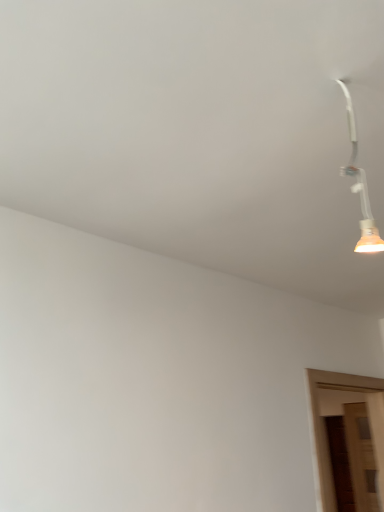
Question: Is wooden door at lower right taller or shorter than white plastic lamp at upper right?

Choices:
 (A) tall
 (B) short

Answer: (A)

Question: From the image's perspective, relative to white plastic lamp at upper right, is wooden door at lower right above or below?

Choices:
 (A) below
 (B) above

Answer: (A)

Question: Considering the positions of point (316, 385) and point (367, 233), is point (316, 385) closer or farther from the camera than point (367, 233)?

Choices:
 (A) farther
 (B) closer

Answer: (A)

Question: From the image's perspective, is white plastic lamp at upper right above or below wooden door at lower right?

Choices:
 (A) below
 (B) above

Answer: (B)

Question: Looking at the image, does white plastic lamp at upper right seem bigger or smaller compared to wooden door at lower right?

Choices:
 (A) small
 (B) big

Answer: (A)

Question: Is white plastic lamp at upper right situated inside wooden door at lower right or outside?

Choices:
 (A) inside
 (B) outside

Answer: (B)

Question: Is point (370, 226) positioned closer to the camera than point (322, 501)?

Choices:
 (A) farther
 (B) closer

Answer: (B)